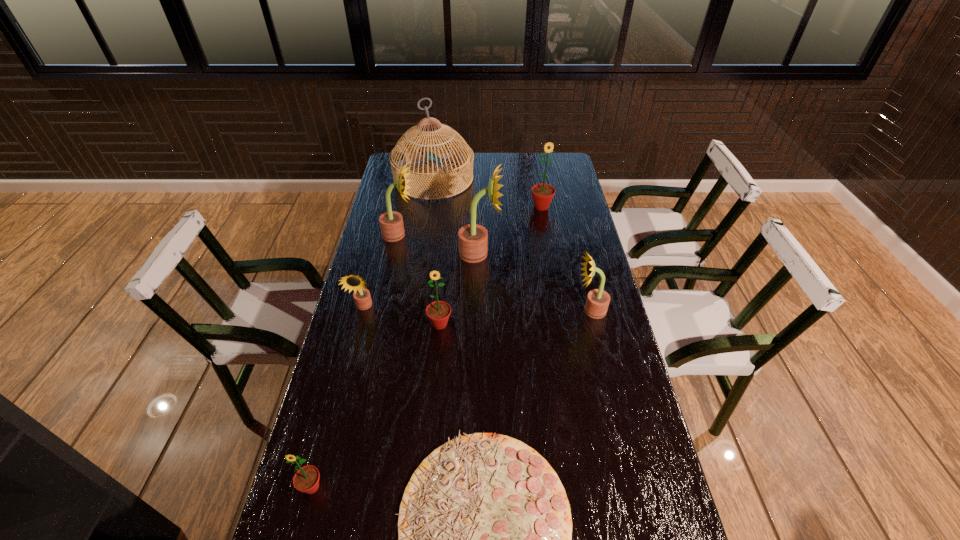
Where is `birdcage`? Image resolution: width=960 pixels, height=540 pixels. birdcage is located at coordinates (x=397, y=158).

The height and width of the screenshot is (540, 960). In order to click on the tallest sunflower in this screenshot , I will do `click(473, 239)`.

Where is `the third sunflower from right to left`? Image resolution: width=960 pixels, height=540 pixels. the third sunflower from right to left is located at coordinates (473, 239).

Find the location of a particular element. The width and height of the screenshot is (960, 540). the second biggest yellow sunflower is located at coordinates pos(391,222).

Locate an element on the screen. The image size is (960, 540). the rightmost green sunflower is located at coordinates (542, 193).

The image size is (960, 540). Identify the location of the farthest green sunflower. (542, 193).

Where is `the second smallest yellow sunflower`? The width and height of the screenshot is (960, 540). the second smallest yellow sunflower is located at coordinates (598, 300).

I want to click on the rightmost object, so click(598, 300).

Identify the location of the second smallest green sunflower. (438, 312).

At what (x,y) coordinates should I click in order to perform the action: click on the second nearest green sunflower. Please return your answer as a coordinate pair (x, y). The image size is (960, 540). Looking at the image, I should click on (438, 312).